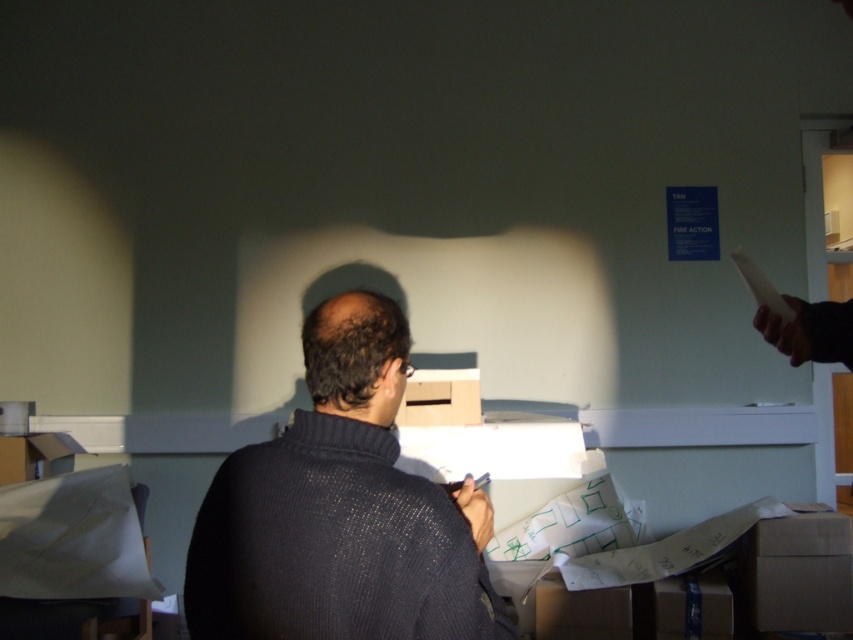
You are a delivery person who needs to place a package on the desk. The package is 1.5 meters long. Can you fit the package horizontally between the dark knit sweater at center and the matte cardboard box at center without moving either object?

The distance between the dark knit sweater at center and the matte cardboard box at center is 1.28 meters. Since the package is 1.5 meters long, it cannot fit horizontally between them as the space is shorter than the package length.

You are standing at the center of the room and want to place a new item at the same 2D location as the cardboard box at lower right. What are the coordinates where you should place the new item?

The coordinates for the cardboard box at lower right are at point (796,573), so you should place the new item at those coordinates.

You are standing in the room and want to determine the relative positions of two points marked on the desk. The first point is at coordinate point (328, 342) and the second is at point (466, 369). Which point is closer to you?

Point (328, 342) is closer to the viewer than point (466, 369).